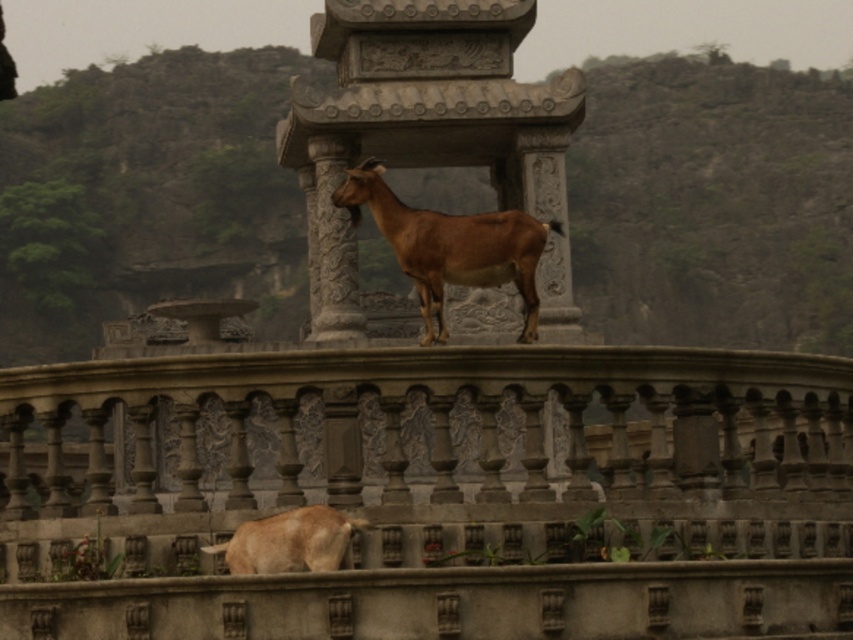
Does brown stone hillside at upper center have a lesser width compared to brown matte goat at lower center?

Incorrect, brown stone hillside at upper center's width is not less than brown matte goat at lower center's.

Is brown stone hillside at upper center further to camera compared to brown matte goat at lower center?

Yes, it is.

Does point (573, 228) come farther from viewer compared to point (341, 547)?

That is True.

The width and height of the screenshot is (853, 640). Find the location of `brown stone hillside at upper center`. brown stone hillside at upper center is located at coordinates (148, 196).

Which is in front, point (526, 304) or point (305, 506)?

Point (305, 506) is more forward.

Identify the location of brown matte goat at center. This screenshot has width=853, height=640. (450, 246).

Can you confirm if brown stone hillside at upper center is positioned to the left of brown matte goat at center?

Yes, brown stone hillside at upper center is to the left of brown matte goat at center.

Which is above, brown stone hillside at upper center or brown matte goat at center?

brown stone hillside at upper center is higher up.

Find the location of a particular element. This screenshot has height=640, width=853. brown stone hillside at upper center is located at coordinates (148, 196).